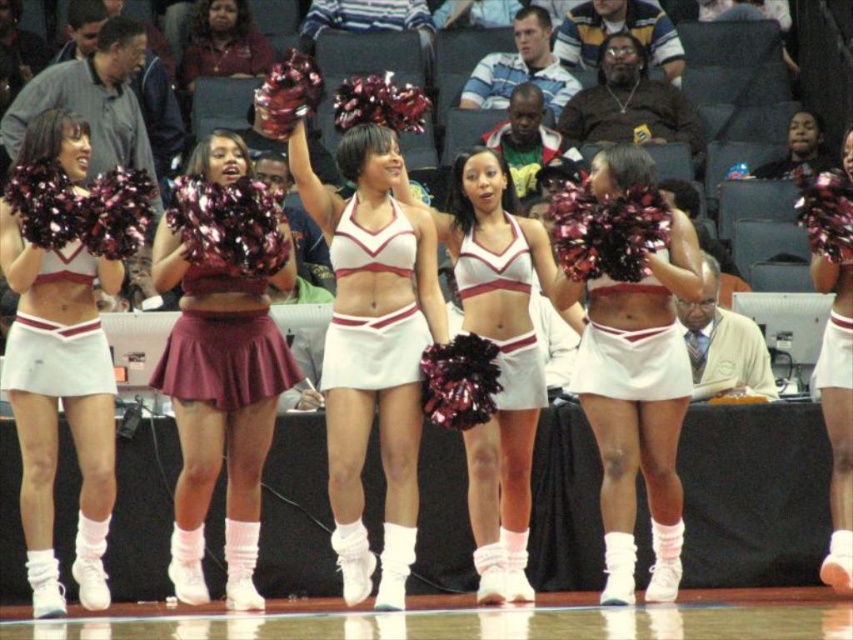
Can you confirm if white matte cheerleading outfit at center is smaller than white matte cheerleading uniform at center?

Incorrect, white matte cheerleading outfit at center is not smaller in size than white matte cheerleading uniform at center.

What are the coordinates of `white matte cheerleading outfit at center` in the screenshot? It's located at (373, 348).

I want to click on white matte cheerleading outfit at center, so click(x=373, y=348).